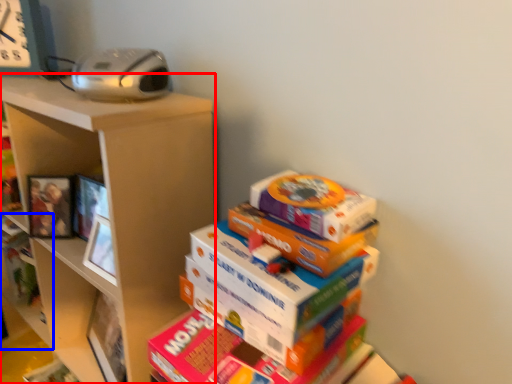
Question: Which object is closer to the camera taking this photo, shelf (highlighted by a red box) or shelf (highlighted by a blue box)?

Choices:
 (A) shelf
 (B) shelf

Answer: (A)